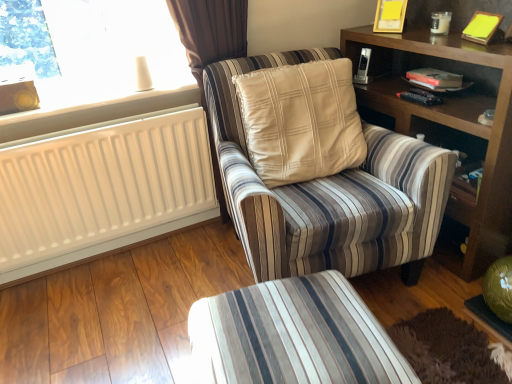
Question: Is yellow paper at upper right closer to camera compared to wooden bookshelf at right?

Choices:
 (A) no
 (B) yes

Answer: (A)

Question: From a real-world perspective, is yellow paper at upper right under wooden bookshelf at right?

Choices:
 (A) yes
 (B) no

Answer: (B)

Question: Does yellow paper at upper right have a smaller size compared to wooden bookshelf at right?

Choices:
 (A) no
 (B) yes

Answer: (B)

Question: Can we say yellow paper at upper right lies outside wooden bookshelf at right?

Choices:
 (A) no
 (B) yes

Answer: (B)

Question: Is wooden bookshelf at right at the back of yellow paper at upper right?

Choices:
 (A) no
 (B) yes

Answer: (A)

Question: Is yellow paper at upper right spatially inside wooden bookshelf at right, or outside of it?

Choices:
 (A) inside
 (B) outside

Answer: (B)

Question: Based on their sizes in the image, would you say yellow paper at upper right is bigger or smaller than wooden bookshelf at right?

Choices:
 (A) big
 (B) small

Answer: (B)

Question: From the image's perspective, is yellow paper at upper right located above or below wooden bookshelf at right?

Choices:
 (A) above
 (B) below

Answer: (A)

Question: Would you say yellow paper at upper right is to the left or to the right of wooden bookshelf at right in the picture?

Choices:
 (A) left
 (B) right

Answer: (B)

Question: From a real-world perspective, is striped fabric ottoman at lower center above or below striped fabric chair at center?

Choices:
 (A) below
 (B) above

Answer: (A)

Question: Considering their positions, is striped fabric ottoman at lower center located in front of or behind striped fabric chair at center?

Choices:
 (A) front
 (B) behind

Answer: (A)

Question: Would you say striped fabric ottoman at lower center is inside or outside striped fabric chair at center?

Choices:
 (A) outside
 (B) inside

Answer: (A)

Question: From their relative heights in the image, would you say striped fabric ottoman at lower center is taller or shorter than striped fabric chair at center?

Choices:
 (A) short
 (B) tall

Answer: (A)

Question: From a real-world perspective, relative to wooden bookshelf at right, is white plastic radiator at upper left vertically above or below?

Choices:
 (A) below
 (B) above

Answer: (B)

Question: Would you say white plastic radiator at upper left is inside or outside wooden bookshelf at right?

Choices:
 (A) outside
 (B) inside

Answer: (A)